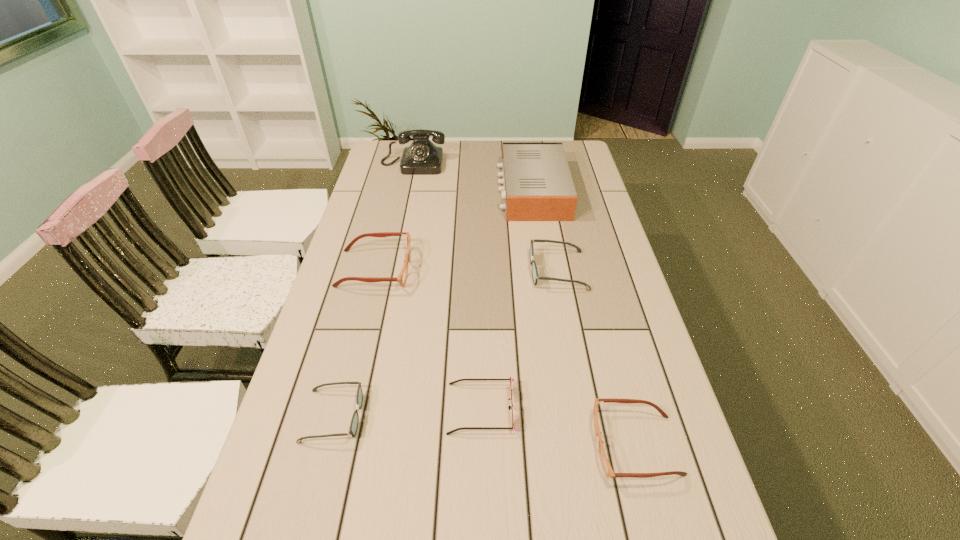
The image size is (960, 540). I want to click on vacant position located on the front-facing side of the nearer brown spectacles, so click(447, 445).

Locate an element on the screen. The image size is (960, 540). vacant region located 0.170m on the front-facing side of the nearer brown spectacles is located at coordinates (516, 445).

The height and width of the screenshot is (540, 960). What are the coordinates of `vacant space located 0.290m on the front-facing side of the nearer brown spectacles` in the screenshot? It's located at (461, 445).

Find the location of a particular element. free space located 0.320m on the bridge of the pink sunglasses is located at coordinates (310, 408).

Find the location of a particular element. vacant space located 0.090m on the bridge of the pink sunglasses is located at coordinates (409, 408).

Where is `vacant area located on the bridge of the pink sunglasses`? This screenshot has width=960, height=540. vacant area located on the bridge of the pink sunglasses is located at coordinates pyautogui.click(x=319, y=408).

The image size is (960, 540). In order to click on vacant area located 0.310m on the face of the left gray spectacles in this screenshot , I will do `click(497, 416)`.

Where is `telephone present at the far edge`? telephone present at the far edge is located at coordinates (422, 157).

You are a GUI agent. You are given a task and a screenshot of the screen. Output one action in this format:
    pyautogui.click(x=<x>, y=<y>)
    Task: Click on the radio receiver present at the far edge
    The image size is (960, 540).
    Given the screenshot: What is the action you would take?
    pyautogui.click(x=537, y=184)

Where is `telephone located in the left edge section of the desktop`? This screenshot has width=960, height=540. telephone located in the left edge section of the desktop is located at coordinates (422, 157).